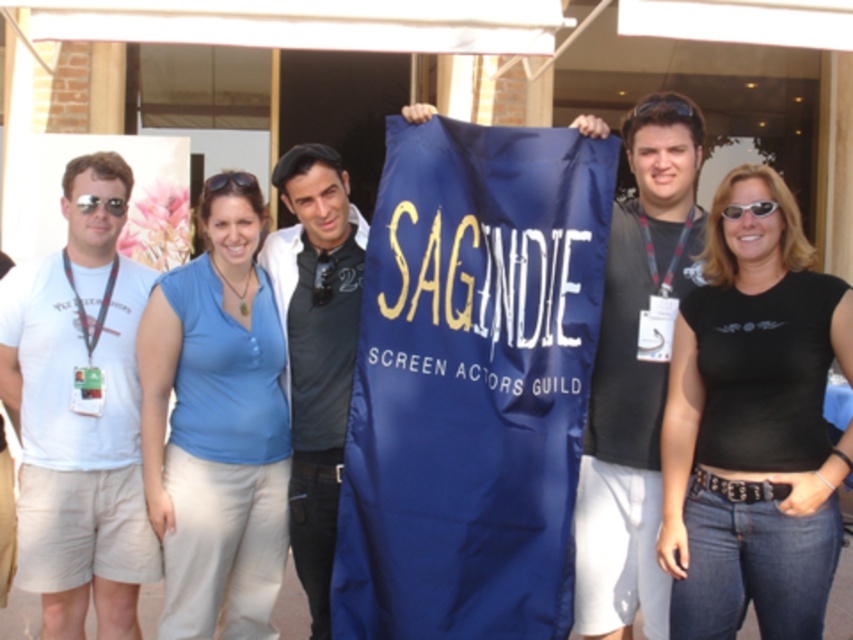
You are a photographer taking a photo of the group. You need to adjust the focus so that both the black cotton shirt at center and the dark gray shirt at center are in clear view. Which shirt should you focus on first to ensure both are sharp?

You should focus on the black cotton shirt at center first since it is closer to the viewer than the dark gray shirt at center. By focusing on the closer object, the depth of field will naturally extend to the farther one, ensuring both are sharp.

You are a photographer adjusting your camera settings to capture the group photo. You notice a point at coordinates (753, 426) in the frame. Based on the scene description, what object is located at this point?

The point at coordinates (753, 426) corresponds to the black cotton shirt at center.